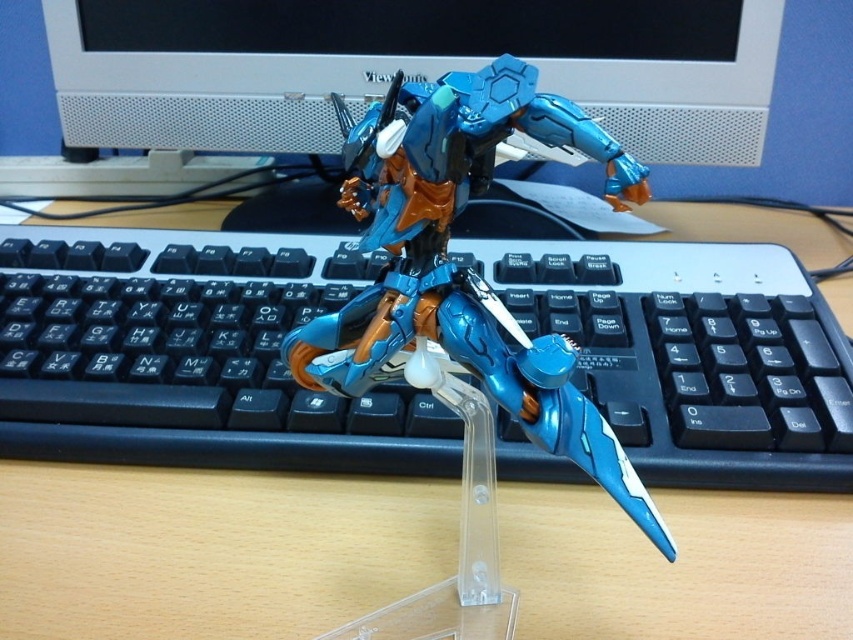
Question: Based on their relative distances, which object is nearer to the metallic blue robot at center?

Choices:
 (A) black plastic keyboard at center
 (B) satin white monitor at upper center

Answer: (A)

Question: Which object is the closest to the black plastic keyboard at center?

Choices:
 (A) satin white monitor at upper center
 (B) metallic blue robot at center

Answer: (A)

Question: Which of the following is the farthest from the observer?

Choices:
 (A) (418, 308)
 (B) (125, 4)

Answer: (B)

Question: Can you confirm if black plastic keyboard at center is smaller than satin white monitor at upper center?

Choices:
 (A) yes
 (B) no

Answer: (B)

Question: Is the position of satin white monitor at upper center less distant than that of metallic blue robot at center?

Choices:
 (A) yes
 (B) no

Answer: (B)

Question: Is black plastic keyboard at center smaller than satin white monitor at upper center?

Choices:
 (A) yes
 (B) no

Answer: (B)